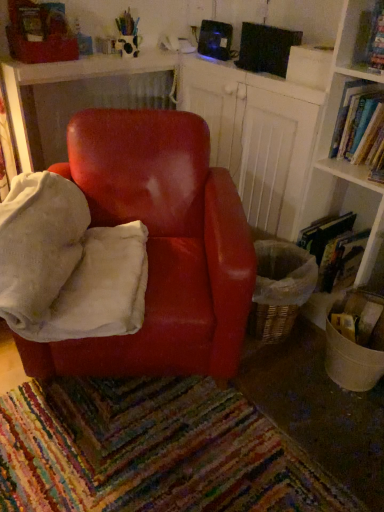
Question: Considering the relative sizes of hardcover book at right, positioned as the 2th book in top-to-bottom order, and glossy leather chair at center in the image provided, is hardcover book at right, positioned as the 2th book in top-to-bottom order, shorter than glossy leather chair at center?

Choices:
 (A) yes
 (B) no

Answer: (A)

Question: Does hardcover book at right, placed as the first book when sorted from bottom to top, have a lesser width compared to glossy leather chair at center?

Choices:
 (A) yes
 (B) no

Answer: (A)

Question: Is hardcover book at right, positioned as the 2th book in top-to-bottom order, surrounding glossy leather chair at center?

Choices:
 (A) yes
 (B) no

Answer: (B)

Question: Considering the relative sizes of hardcover book at right, positioned as the 2th book in top-to-bottom order, and glossy leather chair at center in the image provided, is hardcover book at right, positioned as the 2th book in top-to-bottom order, bigger than glossy leather chair at center?

Choices:
 (A) no
 (B) yes

Answer: (A)

Question: Is hardcover book at right, placed as the first book when sorted from bottom to top, smaller than glossy leather chair at center?

Choices:
 (A) yes
 (B) no

Answer: (A)

Question: Are hardcover book at right, placed as the first book when sorted from bottom to top, and glossy leather chair at center beside each other?

Choices:
 (A) no
 (B) yes

Answer: (A)

Question: From the image's perspective, is wooden bookshelf at upper right on velvety white bean bag at center?

Choices:
 (A) no
 (B) yes

Answer: (B)

Question: Could you tell me if wooden bookshelf at upper right is turned towards velvety white bean bag at center?

Choices:
 (A) no
 (B) yes

Answer: (B)

Question: From a real-world perspective, does wooden bookshelf at upper right stand above velvety white bean bag at center?

Choices:
 (A) yes
 (B) no

Answer: (B)

Question: Does wooden bookshelf at upper right have a lesser height compared to velvety white bean bag at center?

Choices:
 (A) no
 (B) yes

Answer: (A)

Question: Is wooden bookshelf at upper right placed right next to velvety white bean bag at center?

Choices:
 (A) yes
 (B) no

Answer: (B)

Question: Is wooden bookshelf at upper right facing away from velvety white bean bag at center?

Choices:
 (A) yes
 (B) no

Answer: (B)

Question: Is velvety white bean bag at center placed right next to glossy leather chair at center?

Choices:
 (A) yes
 (B) no

Answer: (B)